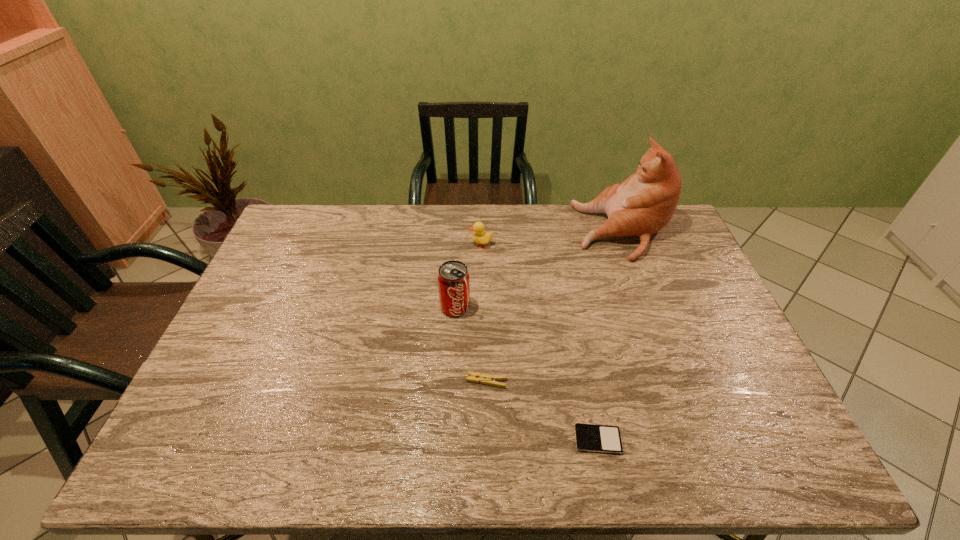
In order to click on free space located on the face of the rightmost object in this screenshot , I will do `click(562, 232)`.

At what (x,y) coordinates should I click in order to perform the action: click on vacant space located 0.370m on the face of the rightmost object. Please return your answer as a coordinate pair (x, y). The height and width of the screenshot is (540, 960). Looking at the image, I should click on (473, 232).

Identify the location of free space located on the front of the third farthest object. (x=452, y=357).

Find the location of a particular element. The width and height of the screenshot is (960, 540). vacant space situated on the front-facing side of the third shortest object is located at coordinates tap(389, 245).

Locate an element on the screen. Image resolution: width=960 pixels, height=540 pixels. free location located 0.230m on the front-facing side of the third shortest object is located at coordinates (403, 245).

Locate an element on the screen. The height and width of the screenshot is (540, 960). vacant space located on the front-facing side of the third shortest object is located at coordinates (445, 245).

At what (x,y) coordinates should I click in order to perform the action: click on vacant space positioned on the left of the clothespin. Please return your answer as a coordinate pair (x, y). The width and height of the screenshot is (960, 540). Looking at the image, I should click on (312, 381).

Where is `free space located on the left of the shortest object`? The width and height of the screenshot is (960, 540). free space located on the left of the shortest object is located at coordinates (404, 440).

The height and width of the screenshot is (540, 960). Find the location of `cat positioned at the far edge`. cat positioned at the far edge is located at coordinates (643, 204).

Where is `duckling at the far edge`? Image resolution: width=960 pixels, height=540 pixels. duckling at the far edge is located at coordinates (480, 237).